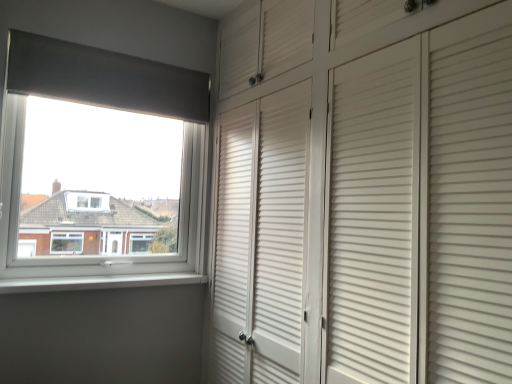
Question: Considering the relative positions of white smooth window sill at lower left and white plastic window at upper left in the image provided, is white smooth window sill at lower left to the left or to the right of white plastic window at upper left?

Choices:
 (A) right
 (B) left

Answer: (A)

Question: From their relative heights in the image, would you say white smooth window sill at lower left is taller or shorter than white plastic window at upper left?

Choices:
 (A) short
 (B) tall

Answer: (A)

Question: Which is correct: white smooth window sill at lower left is inside white plastic window at upper left, or outside of it?

Choices:
 (A) outside
 (B) inside

Answer: (A)

Question: Is white plastic window at upper left inside or outside of white smooth window sill at lower left?

Choices:
 (A) outside
 (B) inside

Answer: (A)

Question: Does point (87, 198) appear closer or farther from the camera than point (131, 286)?

Choices:
 (A) farther
 (B) closer

Answer: (A)

Question: In terms of height, does white plastic window at upper left look taller or shorter compared to white smooth window sill at lower left?

Choices:
 (A) short
 (B) tall

Answer: (B)

Question: From the image's perspective, is white plastic window at upper left positioned above or below white smooth window sill at lower left?

Choices:
 (A) below
 (B) above

Answer: (B)